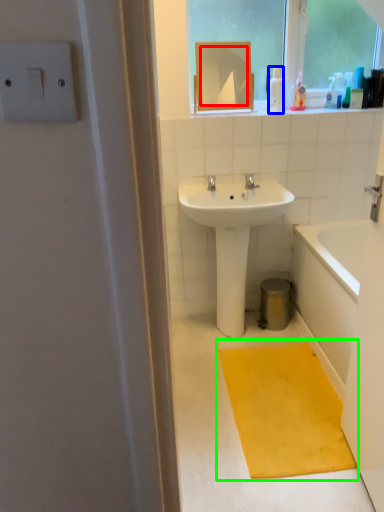
Question: Which is farther away from mirror (highlighted by a red box)? toiletry (highlighted by a blue box) or doormat (highlighted by a green box)?

Choices:
 (A) toiletry
 (B) doormat

Answer: (B)